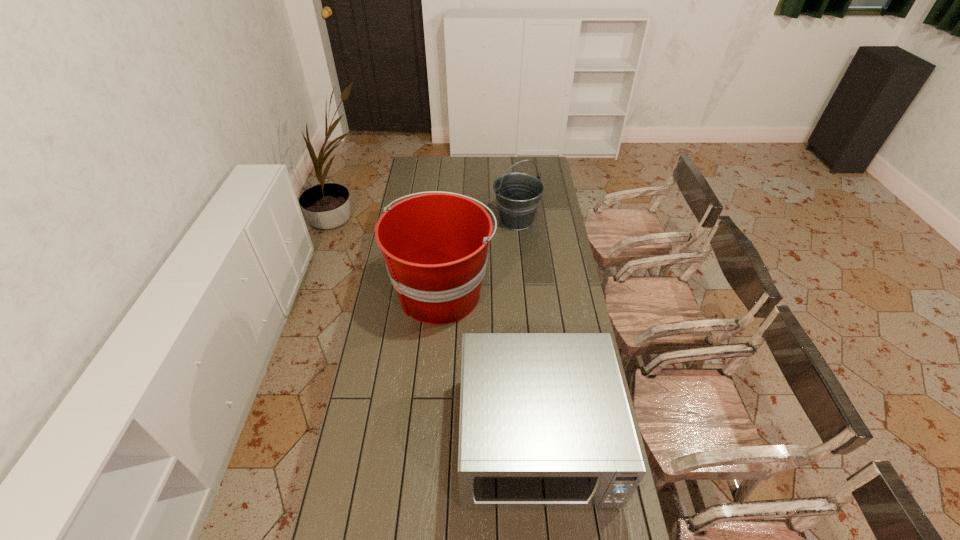
The width and height of the screenshot is (960, 540). Identify the location of vacant space at the left edge of the desktop. (426, 179).

The height and width of the screenshot is (540, 960). Find the location of `vacant space at the right edge of the desktop`. vacant space at the right edge of the desktop is located at coordinates (559, 215).

Locate an element on the screen. This screenshot has height=540, width=960. vacant space at the far right corner of the desktop is located at coordinates (531, 168).

The height and width of the screenshot is (540, 960). What are the coordinates of `vacant area between the microwave oven and the farthest object` in the screenshot? It's located at (526, 330).

Identify the location of vacant space that's between the shortest object and the farther bucket. The width and height of the screenshot is (960, 540). pyautogui.click(x=526, y=330).

Locate an element on the screen. The width and height of the screenshot is (960, 540). object that is the closest to the second nearest object is located at coordinates (518, 194).

Locate an element on the screen. The height and width of the screenshot is (540, 960). object identified as the second closest to the microwave oven is located at coordinates [x=518, y=194].